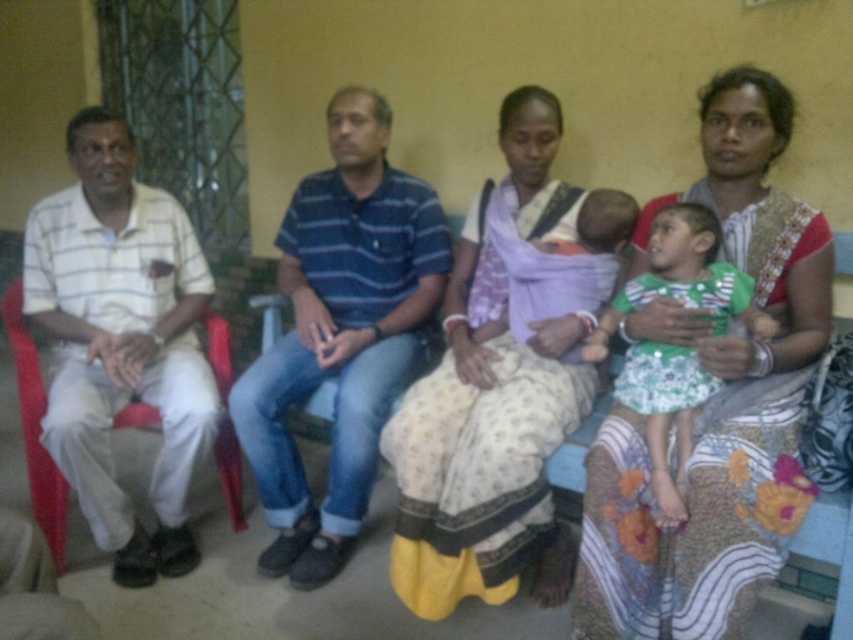
Is blue striped shirt at center to the left of green striped shirt at center from the viewer's perspective?

Yes, blue striped shirt at center is to the left of green striped shirt at center.

Who is more distant from viewer, [434,225] or [691,225]?

Point [434,225]

Which is behind, point (422, 339) or point (635, 305)?

The point (422, 339) is more distant.

This screenshot has width=853, height=640. What are the coordinates of `blue striped shirt at center` in the screenshot? It's located at (340, 333).

Which is in front, point (418, 564) or point (340, 557)?

Positioned in front is point (418, 564).

Can you confirm if light purple fabric baby carrier at center is positioned to the right of blue striped shirt at center?

Indeed, light purple fabric baby carrier at center is positioned on the right side of blue striped shirt at center.

Who is more distant from viewer, (454,308) or (369,337)?

The point (369,337) is behind.

In order to click on light purple fabric baby carrier at center in this screenshot , I will do `click(498, 387)`.

Can you confirm if white cotton shirt at left is wider than green striped shirt at center?

Yes, white cotton shirt at left is wider than green striped shirt at center.

Who is taller, white cotton shirt at left or green striped shirt at center?

white cotton shirt at left is taller.

What are the coordinates of `white cotton shirt at left` in the screenshot? It's located at (120, 340).

I want to click on white cotton shirt at left, so click(120, 340).